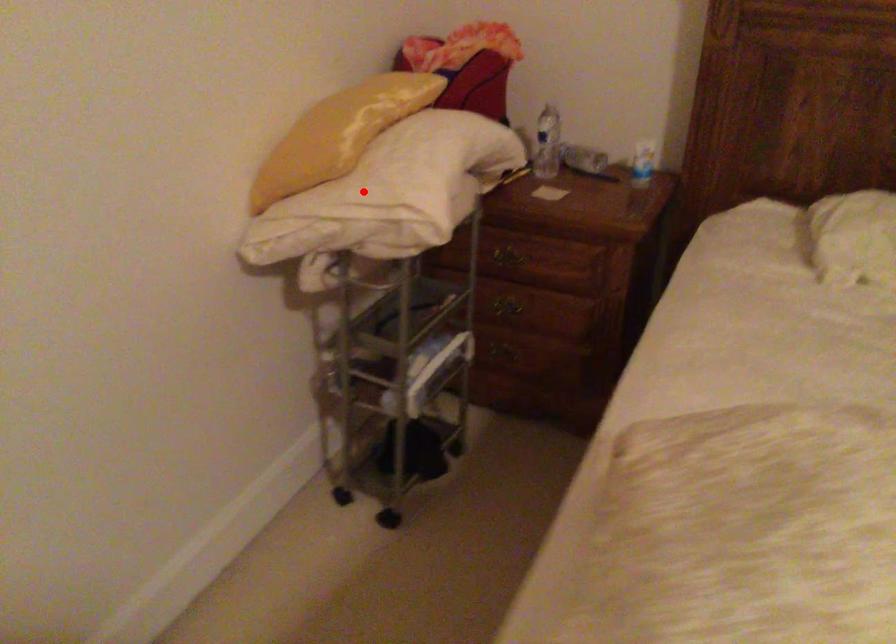
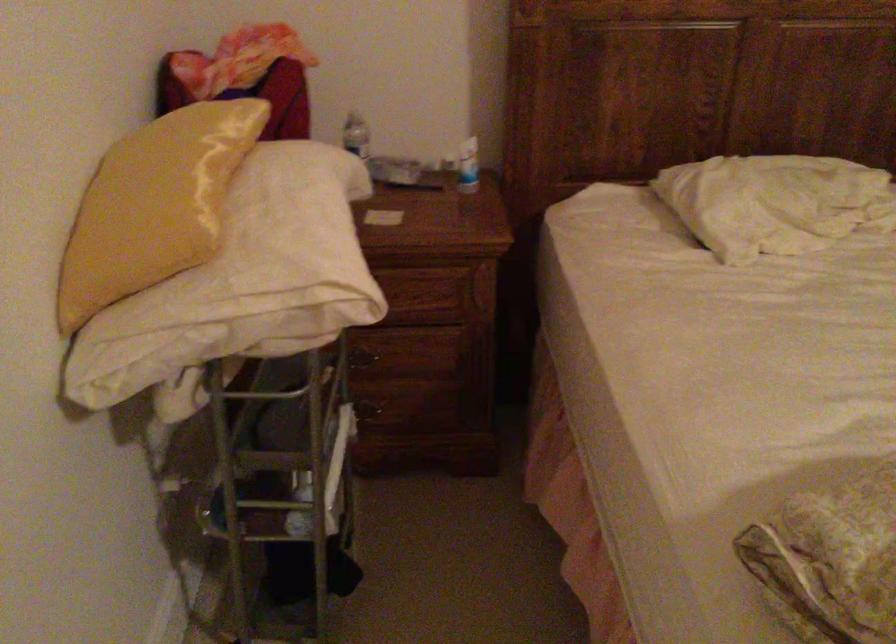
Question: I am providing you with two images of the same scene from different viewpoints. Given a red point in image1, look at the same physical point in image2. Is it:

Choices:
 (A) Closer to the viewpoint
 (B) Farther from the viewpoint

Answer: (A)